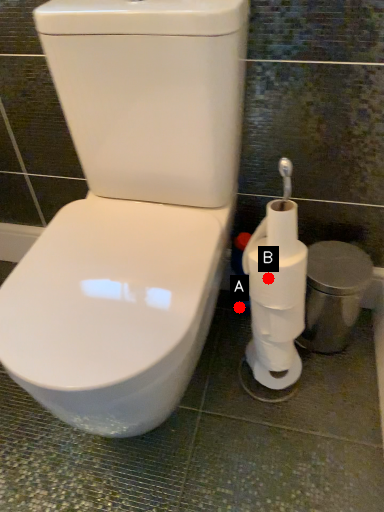
Question: Two points are circled on the image, labeled by A and B beside each circle. Among these points, which one is farthest from the camera?

Choices:
 (A) A is further
 (B) B is further

Answer: (A)